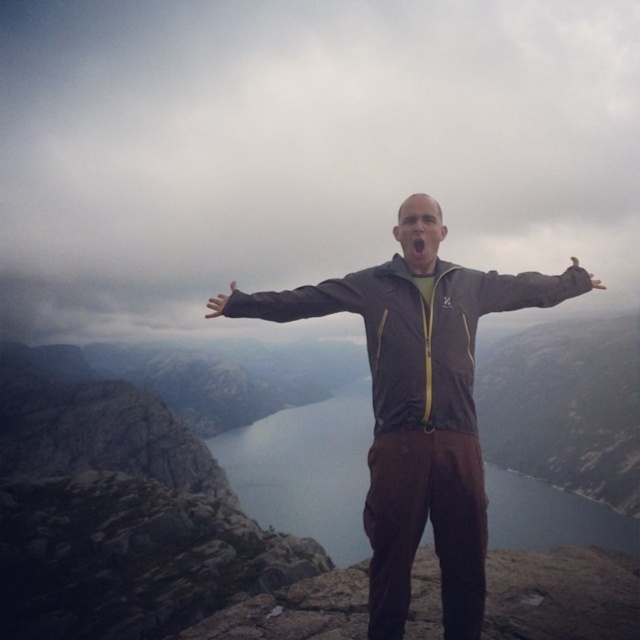
You are a photographer trying to capture the person in the scene. The person has their arms outstretched. You need to focus on the brown fabric arm at center represented by point (532, 289). What is the coordinate of the arm?

The brown fabric arm at center is represented by point (532, 289).

You are a photographer trying to capture the scene of a person standing on a rocky outcrop with their arms outstretched. You notice the brown fabric arm at center and the matte brown hand at center. Which object is wider in the image?

The matte brown hand at center is wider than the brown fabric arm at center.